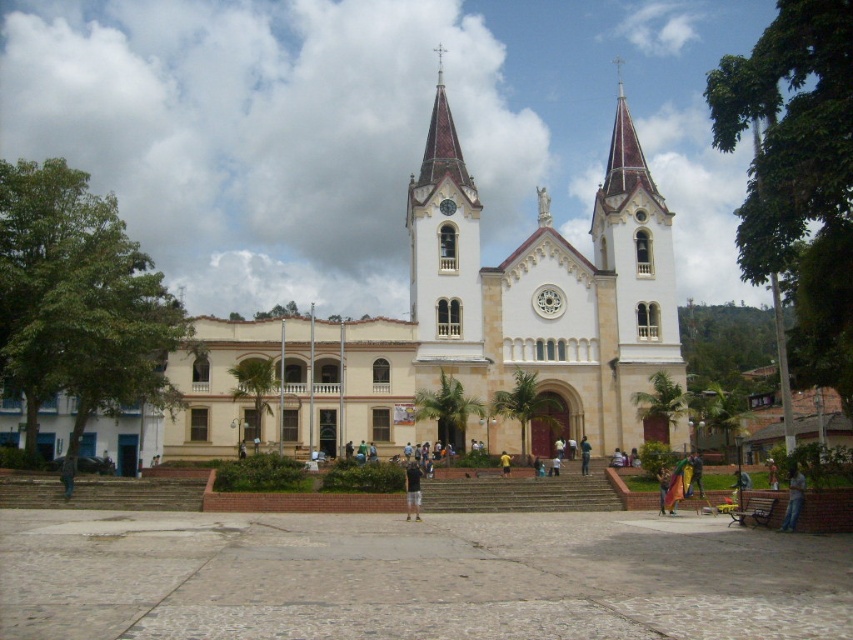
Question: Which of the following is the closest to the observer?

Choices:
 (A) (508, 468)
 (B) (70, 477)
 (C) (619, 195)
 (D) (138, 493)

Answer: (B)

Question: Where is white stone tower at center located in relation to brown leather jacket at lower left in the image?

Choices:
 (A) below
 (B) above

Answer: (B)

Question: Does denim jeans at lower right appear over green fabric pants at center?

Choices:
 (A) yes
 (B) no

Answer: (B)

Question: Among these objects, which one is nearest to the camera?

Choices:
 (A) yellow matte shirt at center
 (B) green fabric pants at center
 (C) dark gray fabric shirt at center
 (D) brown brick stairs at lower center

Answer: (C)

Question: Which point appears farthest from the camera in this image?

Choices:
 (A) click(412, 472)
 (B) click(585, 465)
 (C) click(340, 353)

Answer: (C)

Question: Does white stone church at center have a larger size compared to dark gray fabric shirt at center?

Choices:
 (A) no
 (B) yes

Answer: (B)